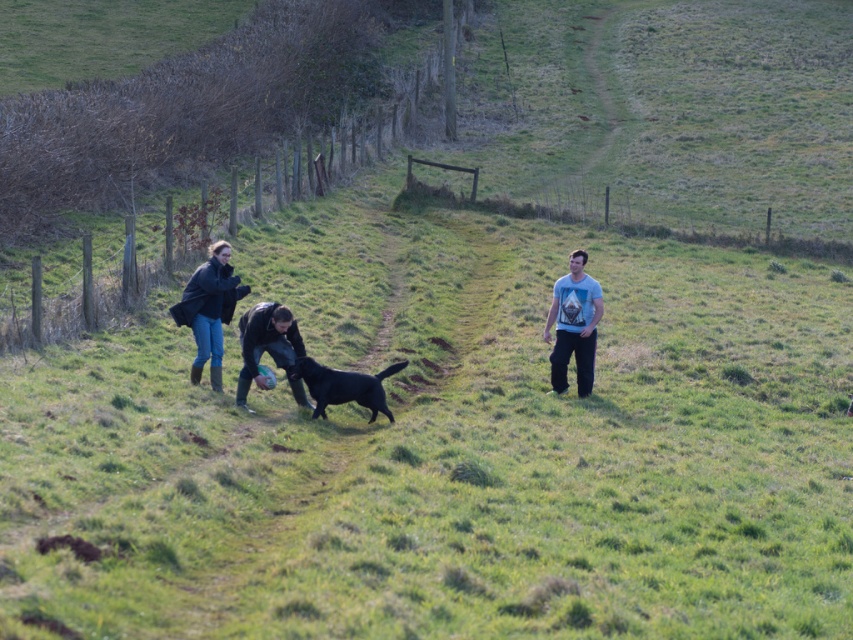
Is light blue t-shirt at center to the left of matte black jacket at center from the viewer's perspective?

No, light blue t-shirt at center is not to the left of matte black jacket at center.

Does light blue t-shirt at center lie in front of matte black jacket at center?

That is False.

The image size is (853, 640). I want to click on light blue t-shirt at center, so 573,324.

Between point (201, 308) and point (293, 376), which one is positioned in front?

Point (293, 376) is in front.

Is dark blue leather jacket at left further to the viewer compared to black glossy dog at center?

Yes, dark blue leather jacket at left is further from the viewer.

The image size is (853, 640). What do you see at coordinates (212, 308) in the screenshot?
I see `dark blue leather jacket at left` at bounding box center [212, 308].

At what (x,y) coordinates should I click in order to perform the action: click on dark blue leather jacket at left. Please return your answer as a coordinate pair (x, y). This screenshot has width=853, height=640. Looking at the image, I should click on (212, 308).

Is light blue t-shirt at center below black glossy dog at center?

Answer: Actually, light blue t-shirt at center is above black glossy dog at center.

Who is more distant from viewer, (558, 307) or (369, 376)?

Point (558, 307)

You are a GUI agent. You are given a task and a screenshot of the screen. Output one action in this format:
    pyautogui.click(x=<x>, y=<y>)
    Task: Click on the light blue t-shirt at center
    The height and width of the screenshot is (640, 853).
    Given the screenshot: What is the action you would take?
    pyautogui.click(x=573, y=324)